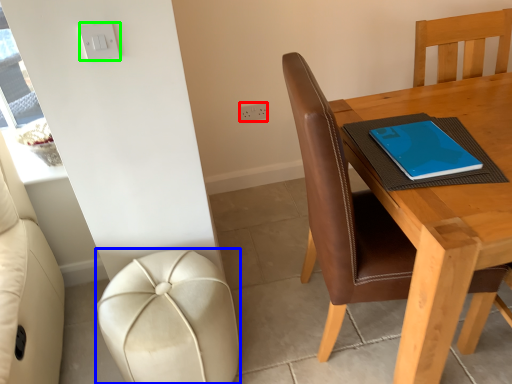
Question: Which object is the farthest from electric outlet (highlighted by a red box)? Choose among these: stool (highlighted by a blue box) or light switch (highlighted by a green box).

Choices:
 (A) stool
 (B) light switch

Answer: (A)